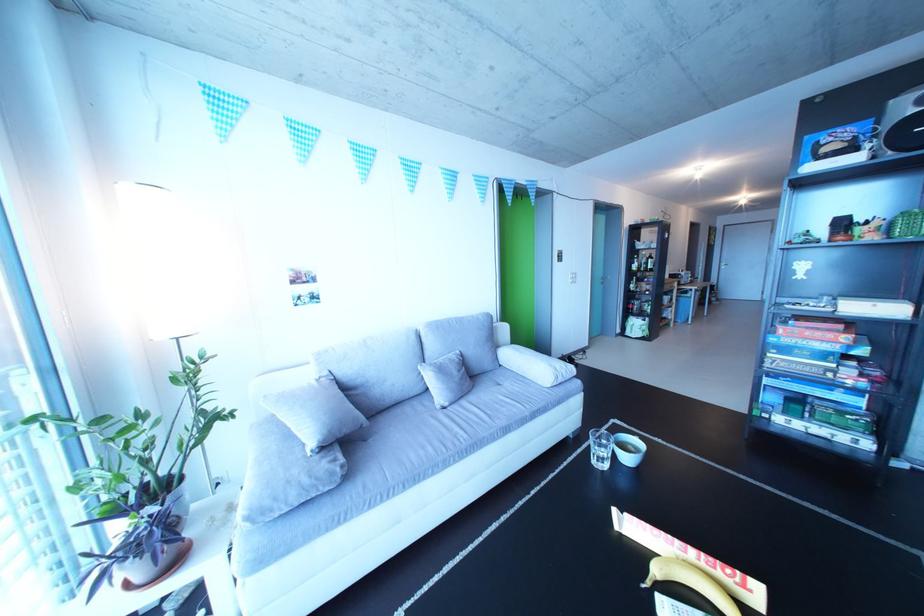
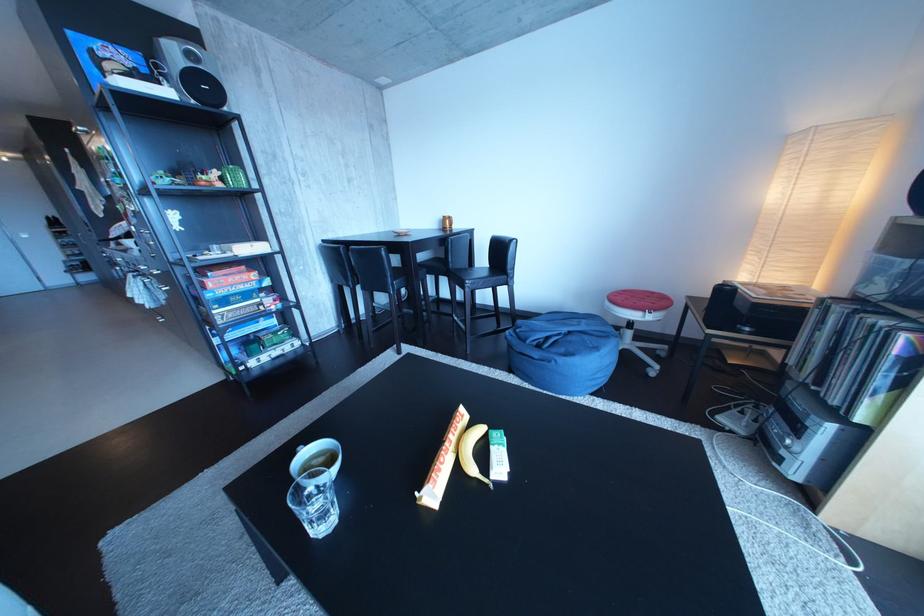
The point at (691,549) is marked in the first image. Where is the corresponding point in the second image?

(459, 450)